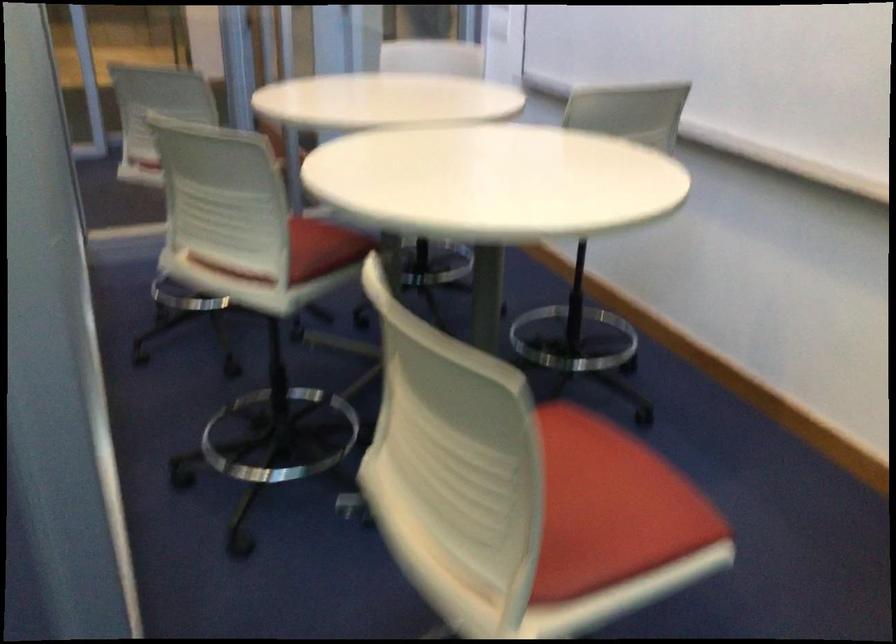
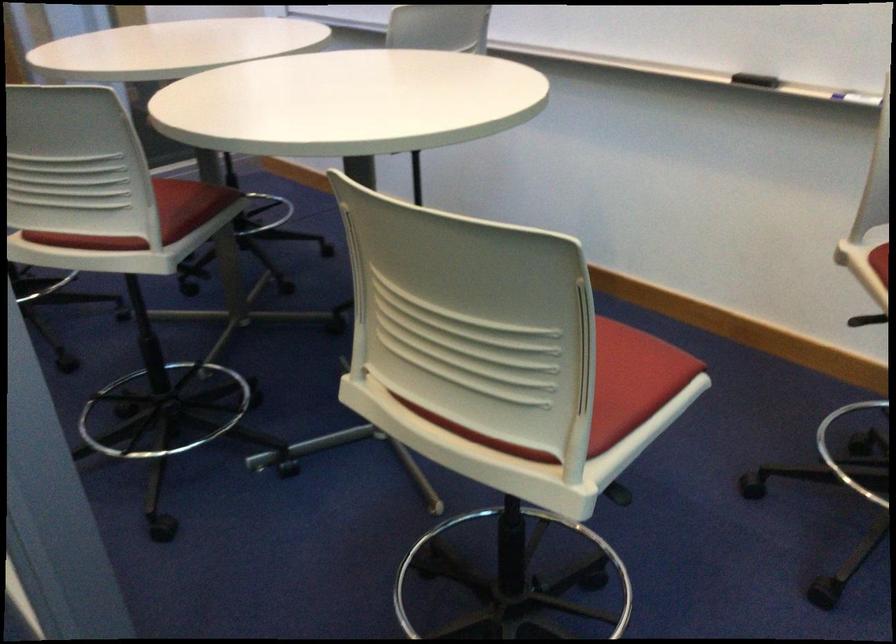
Locate, in the second image, the point that corresponds to point 323,251 in the first image.

(187, 205)